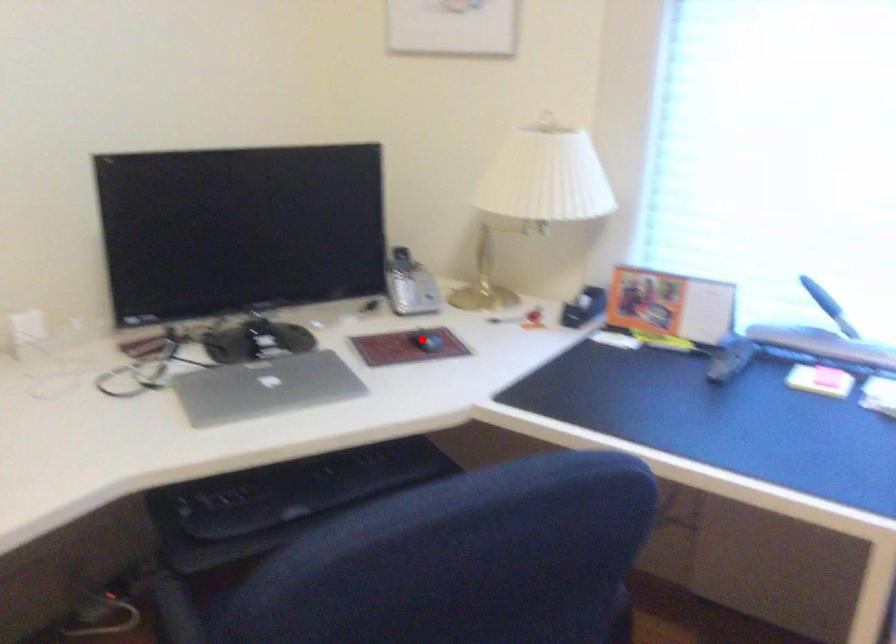
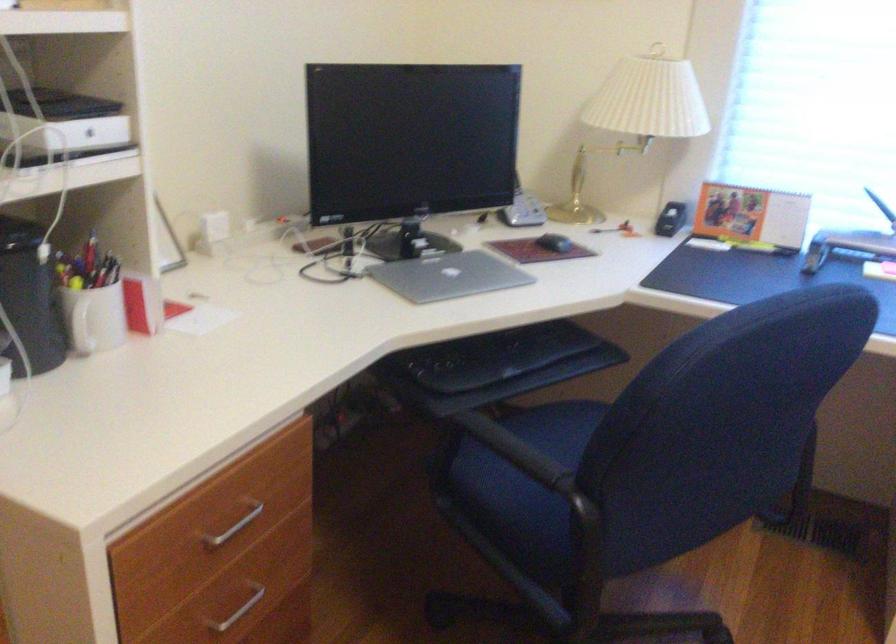
Locate, in the second image, the point that corresponds to the highlighted location in the first image.

(554, 243)